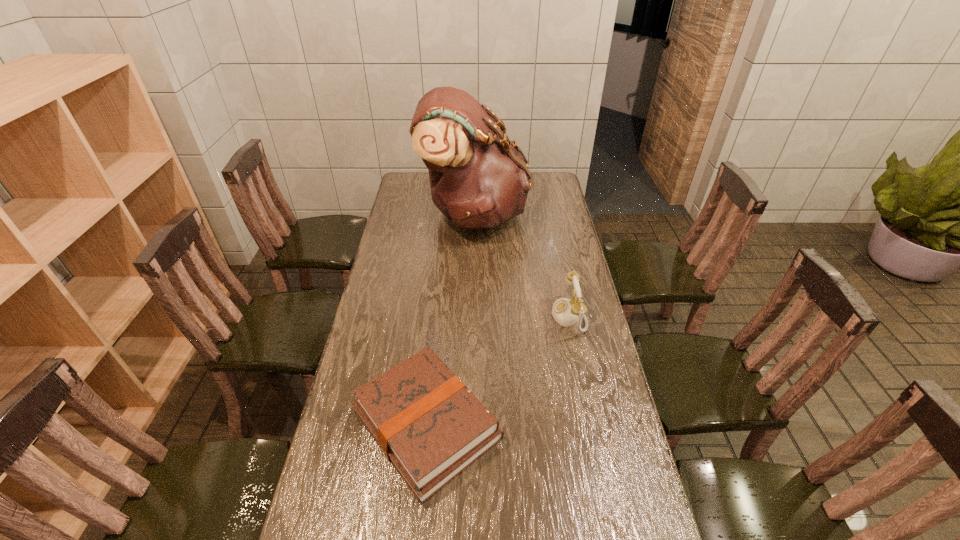
What are the coordinates of `blank area located 0.380m on the back of the hardback book` in the screenshot? It's located at (441, 283).

Where is `object that is at the far edge`? object that is at the far edge is located at coordinates (479, 178).

Find the location of a particular element. This screenshot has height=540, width=960. satchel situated at the left edge is located at coordinates (479, 178).

You are a GUI agent. You are given a task and a screenshot of the screen. Output one action in this format:
    pyautogui.click(x=<x>, y=<y>)
    Task: Click on the hardback book at the left edge
    Image resolution: width=960 pixels, height=540 pixels.
    Given the screenshot: What is the action you would take?
    pyautogui.click(x=428, y=424)

At what (x,y) coordinates should I click in order to perform the action: click on object that is at the right edge. Please return your answer as a coordinate pair (x, y). Looking at the image, I should click on click(x=565, y=312).

I want to click on object present at the far left corner, so click(x=479, y=178).

Image resolution: width=960 pixels, height=540 pixels. In the image, there is a desktop. In order to click on vacant space at the left edge in this screenshot , I will do `click(418, 264)`.

Locate an element on the screen. This screenshot has width=960, height=540. free space at the right edge of the desktop is located at coordinates (598, 341).

Find the location of `vacant space that is in between the hardback book and the tallest object`. vacant space that is in between the hardback book and the tallest object is located at coordinates 450,319.

Find the location of a particular element. This screenshot has width=960, height=540. free point between the rightmost object and the satchel is located at coordinates tap(521, 265).